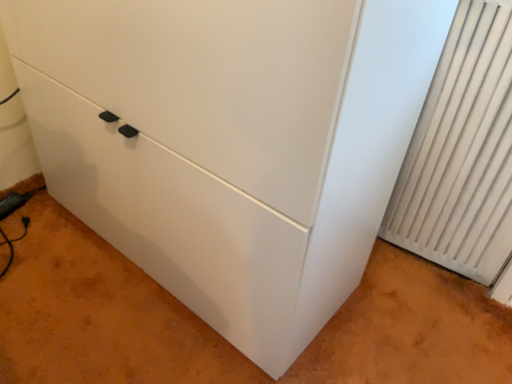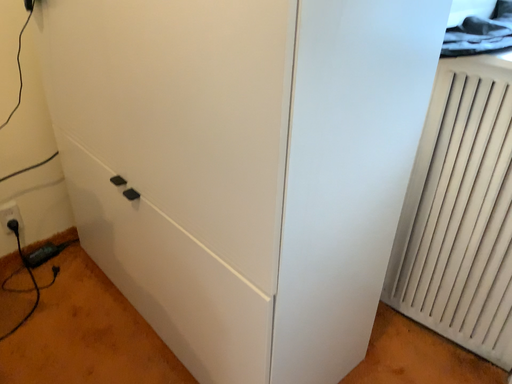
Question: How did the camera likely rotate when shooting the video?

Choices:
 (A) rotated left
 (B) rotated right

Answer: (A)